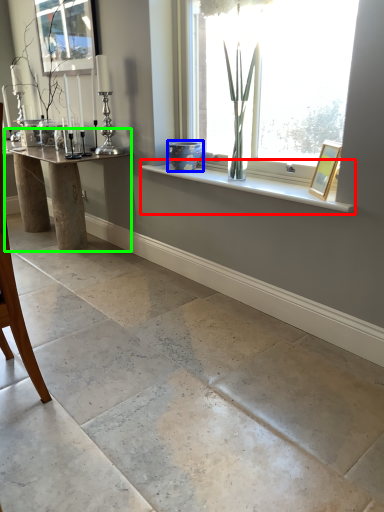
Question: Which object is the closest to the window sill (highlighted by a red box)? Choose among these: glass vase (highlighted by a blue box) or table (highlighted by a green box).

Choices:
 (A) glass vase
 (B) table

Answer: (A)